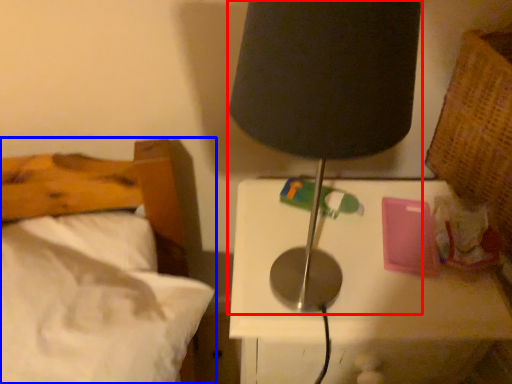
Question: Which point is further to the camera, lamp (highlighted by a red box) or bed (highlighted by a blue box)?

Choices:
 (A) lamp
 (B) bed

Answer: (B)